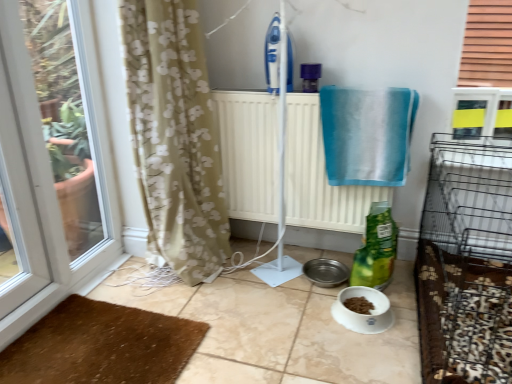
Where is `vacant space to the right of brown textured mat at lower left`? vacant space to the right of brown textured mat at lower left is located at coordinates (244, 329).